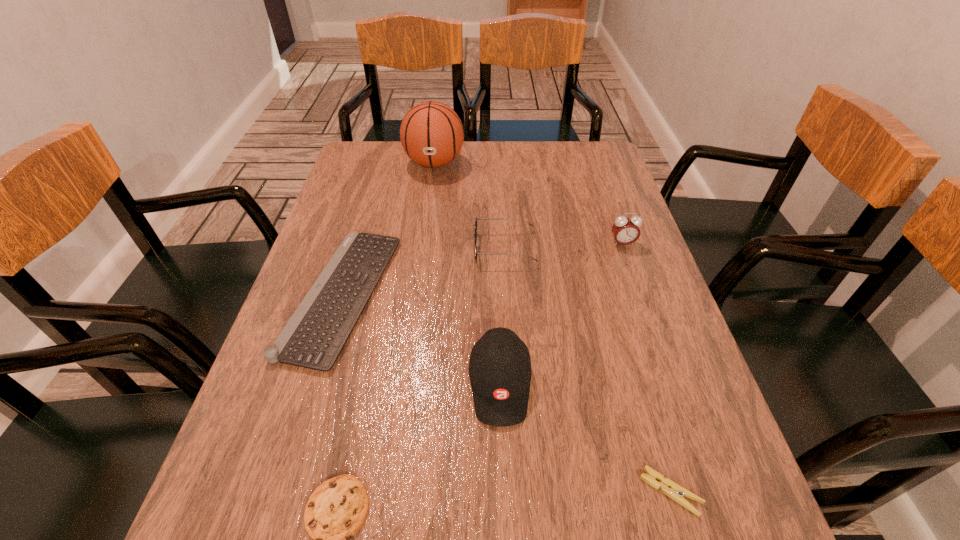
Select which object is the third closest to the clothespin. Please provide its 2D coordinates. Your answer should be formatted as a tuple, i.e. [(x, y)], where the tuple contains the x and y coordinates of a point satisfying the conditions above.

[(475, 234)]

Locate an element on the screen. This screenshot has width=960, height=540. free spot that satisfies the following two spatial constraints: 1. with a logo on the front of the baseball cap; 2. on the left side of the shortest object is located at coordinates 504,491.

Image resolution: width=960 pixels, height=540 pixels. Find the location of `vacant space that satisfies the following two spatial constraints: 1. on the clock face of the alarm clock; 2. through the lenses of the spectacles`. vacant space that satisfies the following two spatial constraints: 1. on the clock face of the alarm clock; 2. through the lenses of the spectacles is located at coordinates tap(624, 248).

At what (x,y) coordinates should I click in order to perform the action: click on vacant region that satisfies the following two spatial constraints: 1. through the lenses of the spectacles; 2. on the front side of the computer keyboard. Please return your answer as a coordinate pair (x, y). Image resolution: width=960 pixels, height=540 pixels. Looking at the image, I should click on (508, 295).